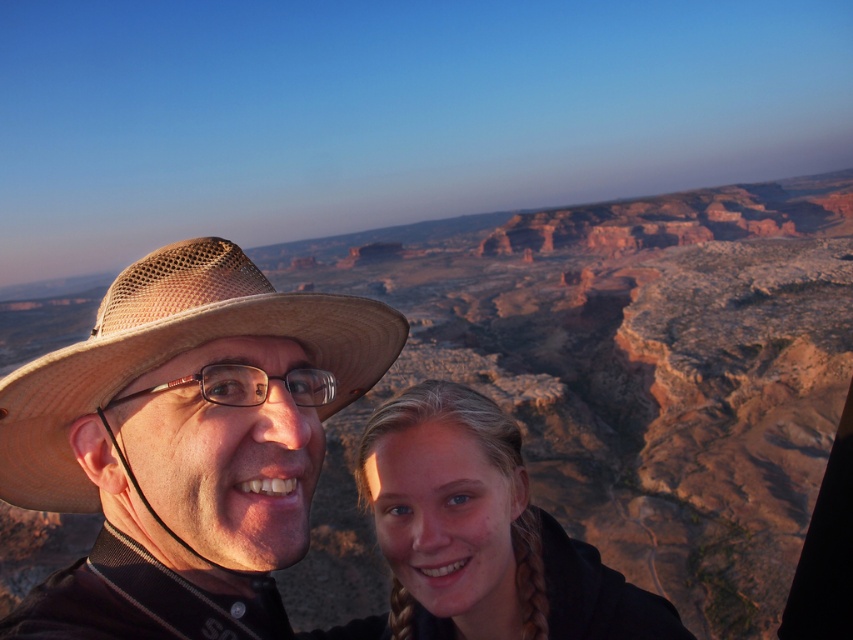
Can you confirm if tan mesh cowboy hat at left is taller than clear plastic glasses at center?

Yes, tan mesh cowboy hat at left is taller than clear plastic glasses at center.

Can you confirm if tan mesh cowboy hat at left is positioned to the right of clear plastic glasses at center?

In fact, tan mesh cowboy hat at left is to the left of clear plastic glasses at center.

The width and height of the screenshot is (853, 640). What are the coordinates of `tan mesh cowboy hat at left` in the screenshot? It's located at (172, 355).

Can you confirm if matte straw hat at left is smaller than clear plastic glasses at center?

No, matte straw hat at left is not smaller than clear plastic glasses at center.

Which is in front, point (175, 474) or point (166, 388)?

Point (166, 388) is in front.

Find the location of a particular element. This screenshot has width=853, height=640. matte straw hat at left is located at coordinates (184, 449).

Is point (184, 320) less distant than point (521, 586)?

Yes, point (184, 320) is closer to viewer.

Does matte straw hat at left appear on the right side of blonde hair at lower center?

Yes, matte straw hat at left is to the right of blonde hair at lower center.

Is point (209, 268) positioned behind point (422, 406)?

No, it is not.

At what (x,y) coordinates should I click in order to perform the action: click on matte straw hat at left. Please return your answer as a coordinate pair (x, y). The width and height of the screenshot is (853, 640). Looking at the image, I should click on (184, 449).